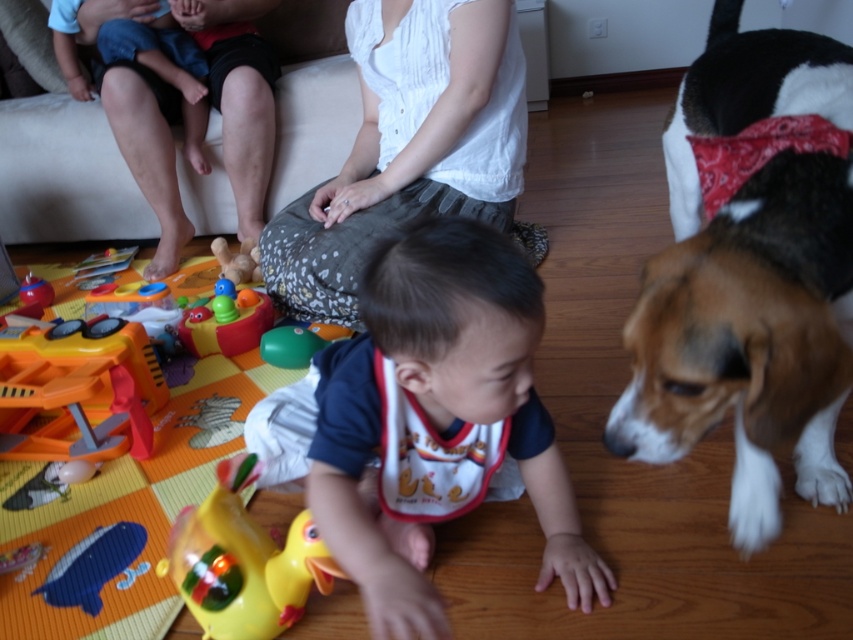
You are a photographer adjusting your camera settings to capture the baby and the dog in focus. The baby is at point [405,96] and the dog is at point [230,326]. Which subject should you focus on first to ensure both are in focus?

You should focus on the baby at point [405,96] first because it is closer to you than the dog at point [230,326]. This way, adjusting the focus from the closer subject to the farther one will help both be in focus.

You are a parent watching your baby play. The baby is crawling towards the brown and white fur dog at right and the yellow rubber duck at center. Which toy is closer to the baby?

The yellow rubber duck at center is closer to the baby because the brown and white fur dog at right is to the right of the yellow rubber duck at center, meaning the duck is positioned between the baby and the dog.

In the scene shown: You are a photographer adjusting your camera to focus on two points in the image. The first point is at coordinate point(679, 400) and the second point is at coordinate point(477, 268). Which point should you focus on first if you want to capture the nearest object in the scene?

Point(679, 400) is closer to the viewer than point(477, 268), so you should focus on point(679, 400) first to capture the nearest object in the scene.